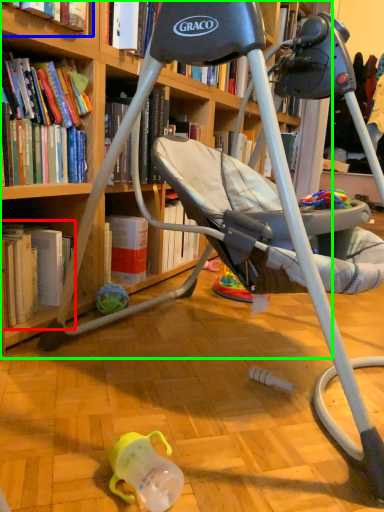
Question: Estimate the real-world distances between objects in this image. Which object is closer to book (highlighted by a red box), book (highlighted by a blue box) or bookcase (highlighted by a green box)?

Choices:
 (A) book
 (B) bookcase

Answer: (B)